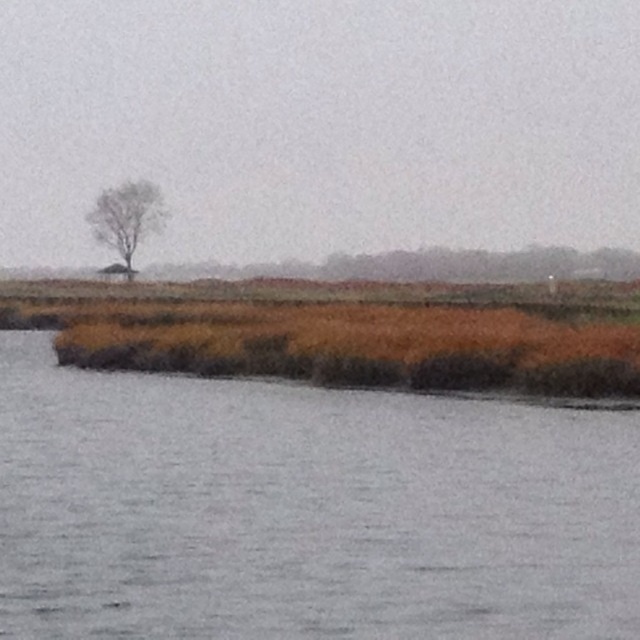
Which of these two, gray matte water at lower left or bare branches tree at upper left, stands shorter?

Standing shorter between the two is gray matte water at lower left.

This screenshot has width=640, height=640. What are the coordinates of `gray matte water at lower left` in the screenshot? It's located at (305, 509).

Locate an element on the screen. gray matte water at lower left is located at coordinates (305, 509).